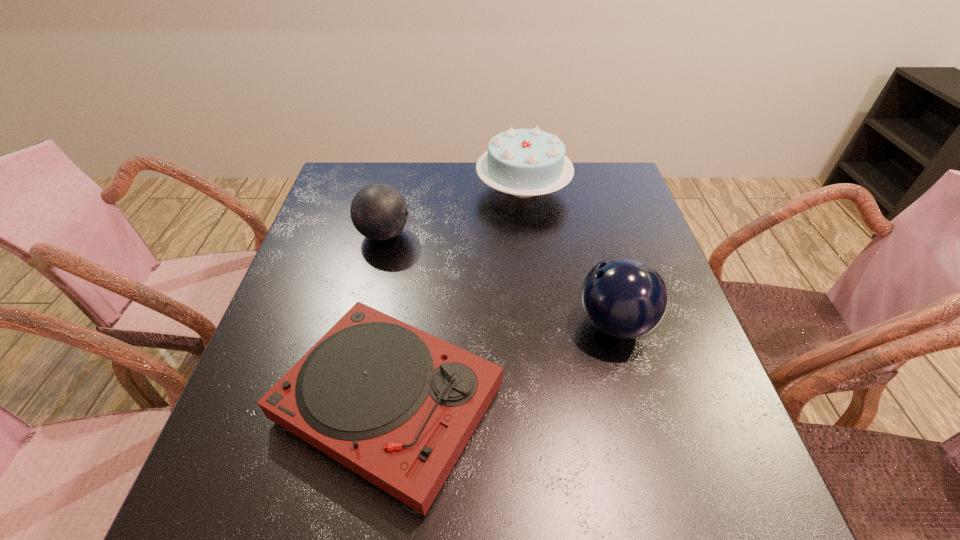
Locate an element on the screen. The image size is (960, 540). birthday cake is located at coordinates (523, 162).

Identify the location of the taller bowling ball. (623, 297).

Locate an element on the screen. the right bowling ball is located at coordinates (623, 297).

I want to click on the left bowling ball, so click(379, 212).

I want to click on the farther bowling ball, so 379,212.

Find the location of a particular element. The image size is (960, 540). the shortest object is located at coordinates (397, 406).

Identify the location of free location located 0.090m on the right of the birthday cake. This screenshot has height=540, width=960. (601, 188).

The height and width of the screenshot is (540, 960). What are the coordinates of `vacant space located 0.390m on the surface of the taller bowling ball near the finger holes` in the screenshot? It's located at (391, 324).

Locate an element on the screen. The height and width of the screenshot is (540, 960). free region located 0.090m on the surface of the taller bowling ball near the finger holes is located at coordinates (533, 324).

Identify the location of free space located on the surface of the taller bowling ball near the finger holes. (486, 324).